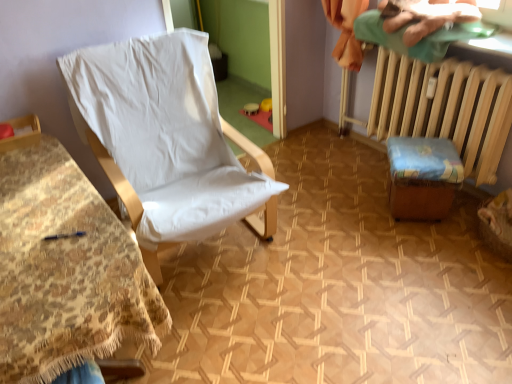
Describe the element at coordinates (445, 108) in the screenshot. Image resolution: width=512 pixels, height=384 pixels. I see `wooden radiator at right` at that location.

Locate an element on the screen. The width and height of the screenshot is (512, 384). wooden stool at lower right, marked as the first furniture in a right-to-left arrangement is located at coordinates (422, 177).

From the picture: Measure the distance between white fabric chair at center and camera.

The depth of white fabric chair at center is 1.67 meters.

What do you see at coordinates (64, 265) in the screenshot? I see `white fabric chair at left, the first furniture positioned from the left` at bounding box center [64, 265].

Identify the location of green cotton cloth at upper right. (428, 16).

From the image's perspective, which object appears higher, green cotton cloth at upper right or wooden radiator at right?

green cotton cloth at upper right.

From a real-world perspective, is green cotton cloth at upper right positioned over wooden radiator at right based on gravity?

Yes.

Considering the positions of points (458, 6) and (442, 134), is point (458, 6) farther from camera compared to point (442, 134)?

No, (458, 6) is in front of (442, 134).

Is green cotton cloth at upper right further to the viewer compared to wooden radiator at right?

No, green cotton cloth at upper right is closer to the viewer.

The height and width of the screenshot is (384, 512). What are the coordinates of `chair below the green cotton cloth at upper right (from the image's perspective)` in the screenshot? It's located at [166, 140].

Which object is positioned more to the right, green cotton cloth at upper right or white fabric chair at center?

Positioned to the right is green cotton cloth at upper right.

Is green cotton cloth at upper right oriented towards white fabric chair at center?

Yes, green cotton cloth at upper right is aimed at white fabric chair at center.

Considering the sizes of green cotton cloth at upper right and white fabric chair at center in the image, is green cotton cloth at upper right wider or thinner than white fabric chair at center?

green cotton cloth at upper right is thinner than white fabric chair at center.

Can you confirm if wooden radiator at right is shorter than white fabric chair at center?

Yes, wooden radiator at right is shorter than white fabric chair at center.

From the image's perspective, is wooden radiator at right located beneath white fabric chair at center?

No, from the image's perspective, wooden radiator at right is not below white fabric chair at center.

Who is smaller, wooden radiator at right or white fabric chair at center?

wooden radiator at right.

Can you tell me how much white fabric chair at center and wooden stool at lower right, marked as the first furniture in a right-to-left arrangement, differ in facing direction?

The angle between the facing direction of white fabric chair at center and the facing direction of wooden stool at lower right, marked as the first furniture in a right-to-left arrangement, is 38.2 degrees.

Is white fabric chair at center to the left or to the right of wooden stool at lower right, the second furniture when ordered from left to right, in the image?

Based on their positions, white fabric chair at center is located to the left of wooden stool at lower right, the second furniture when ordered from left to right.

Is the depth of white fabric chair at center greater than that of wooden stool at lower right, marked as the first furniture in a right-to-left arrangement?

No, the depth of white fabric chair at center is less than that of wooden stool at lower right, marked as the first furniture in a right-to-left arrangement.

Is white fabric chair at left, the first furniture positioned from the left, facing away from wooden radiator at right?

No.

Who is smaller, white fabric chair at left, the second furniture from the right, or wooden radiator at right?

wooden radiator at right.

In the scene shown: Would you say white fabric chair at left, the first furniture positioned from the left, is inside or outside wooden radiator at right?

white fabric chair at left, the first furniture positioned from the left, is outside wooden radiator at right.

From the image's perspective, is white fabric chair at left, the second furniture from the right, below wooden radiator at right?

Yes, from the image's perspective, white fabric chair at left, the second furniture from the right, is beneath wooden radiator at right.

Is the position of green cotton cloth at upper right more distant than that of white fabric chair at left, the second furniture from the right?

Yes, green cotton cloth at upper right is behind white fabric chair at left, the second furniture from the right.

Is green cotton cloth at upper right touching white fabric chair at left, the second furniture from the right?

green cotton cloth at upper right is not next to white fabric chair at left, the second furniture from the right, and they're not touching.

From the image's perspective, is green cotton cloth at upper right on top of white fabric chair at left, the first furniture positioned from the left?

Yes.

Which object is thinner, green cotton cloth at upper right or wooden stool at lower right, marked as the first furniture in a right-to-left arrangement?

wooden stool at lower right, marked as the first furniture in a right-to-left arrangement, is thinner.

The image size is (512, 384). Find the location of `furniture behind the green cotton cloth at upper right`. furniture behind the green cotton cloth at upper right is located at coordinates (422, 177).

Is green cotton cloth at upper right oriented towards wooden stool at lower right, marked as the first furniture in a right-to-left arrangement?

No, green cotton cloth at upper right is not facing towards wooden stool at lower right, marked as the first furniture in a right-to-left arrangement.

Identify the location of radiator on the right of green cotton cloth at upper right. The height and width of the screenshot is (384, 512). (445, 108).

Locate an element on the screen. chair below the green cotton cloth at upper right (from the image's perspective) is located at coordinates (166, 140).

Considering their positions, is green cotton cloth at upper right positioned further to white fabric chair at left, the second furniture from the right, than white fabric chair at center?

green cotton cloth at upper right is further to white fabric chair at left, the second furniture from the right.

Looking at this image, estimate the real-world distances between objects in this image. Which object is closer to green cotton cloth at upper right, white fabric chair at center or wooden stool at lower right, marked as the first furniture in a right-to-left arrangement?

Among the two, wooden stool at lower right, marked as the first furniture in a right-to-left arrangement, is located nearer to green cotton cloth at upper right.

When comparing their distances from white fabric chair at center, does white fabric chair at left, the first furniture positioned from the left, or wooden radiator at right seem further?

The object further to white fabric chair at center is wooden radiator at right.

When comparing their distances from white fabric chair at left, the second furniture from the right, does wooden radiator at right or white fabric chair at center seem further?

Among the two, wooden radiator at right is located further to white fabric chair at left, the second furniture from the right.

Estimate the real-world distances between objects in this image. Which object is further from wooden stool at lower right, the second furniture when ordered from left to right, green cotton cloth at upper right or white fabric chair at left, the second furniture from the right?

white fabric chair at left, the second furniture from the right, is further to wooden stool at lower right, the second furniture when ordered from left to right.

Which object lies nearer to the anchor point wooden radiator at right, white fabric chair at left, the first furniture positioned from the left, or green cotton cloth at upper right?

green cotton cloth at upper right is closer to wooden radiator at right.

In the scene shown: Estimate the real-world distances between objects in this image. Which object is closer to white fabric chair at center, wooden radiator at right or white fabric chair at left, the first furniture positioned from the left?

white fabric chair at left, the first furniture positioned from the left, is closer to white fabric chair at center.

Based on the photo, based on their spatial positions, is wooden stool at lower right, the second furniture when ordered from left to right, or white fabric chair at center further from white fabric chair at left, the second furniture from the right?

wooden stool at lower right, the second furniture when ordered from left to right, is positioned further to the anchor white fabric chair at left, the second furniture from the right.

Identify the location of chair located between white fabric chair at left, the second furniture from the right, and wooden stool at lower right, marked as the first furniture in a right-to-left arrangement, in the left-right direction. (166, 140).

The height and width of the screenshot is (384, 512). In order to click on fabric between white fabric chair at left, the first furniture positioned from the left, and wooden stool at lower right, marked as the first furniture in a right-to-left arrangement, from left to right in this screenshot , I will do `click(428, 16)`.

You are a GUI agent. You are given a task and a screenshot of the screen. Output one action in this format:
    pyautogui.click(x=<x>, y=<y>)
    Task: Click on the radiator between green cotton cloth at upper right and wooden stool at lower right, marked as the first furniture in a right-to-left arrangement, in the up-down direction
    The image size is (512, 384).
    Given the screenshot: What is the action you would take?
    pyautogui.click(x=445, y=108)

Identify the location of chair between white fabric chair at left, the second furniture from the right, and green cotton cloth at upper right, in the horizontal direction. Image resolution: width=512 pixels, height=384 pixels. (166, 140).